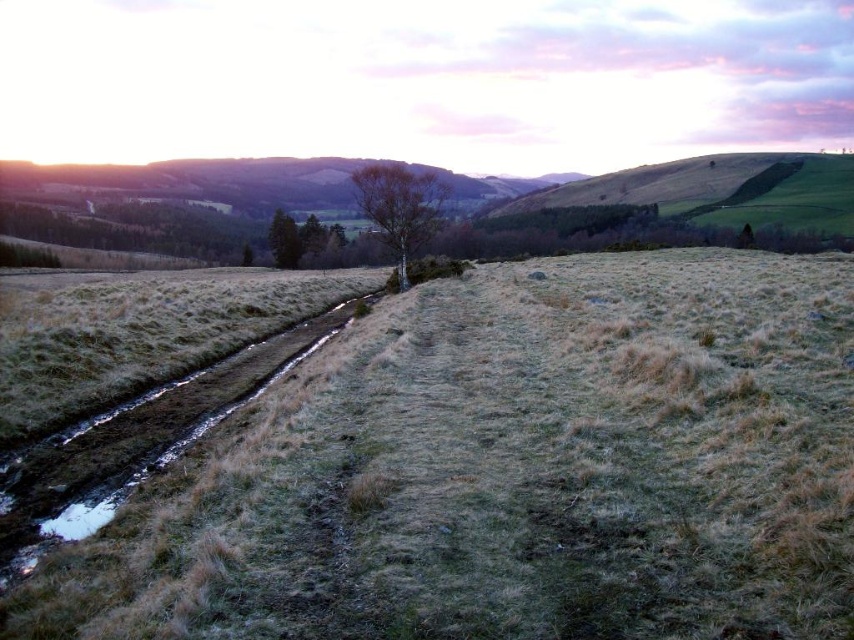
You are a hiker trying to cross the field. You see the dry grass at center and the green matte tree at center. Which one is wider?

The dry grass at center is wider than the green matte tree at center because the dry grass at center has a greater width.